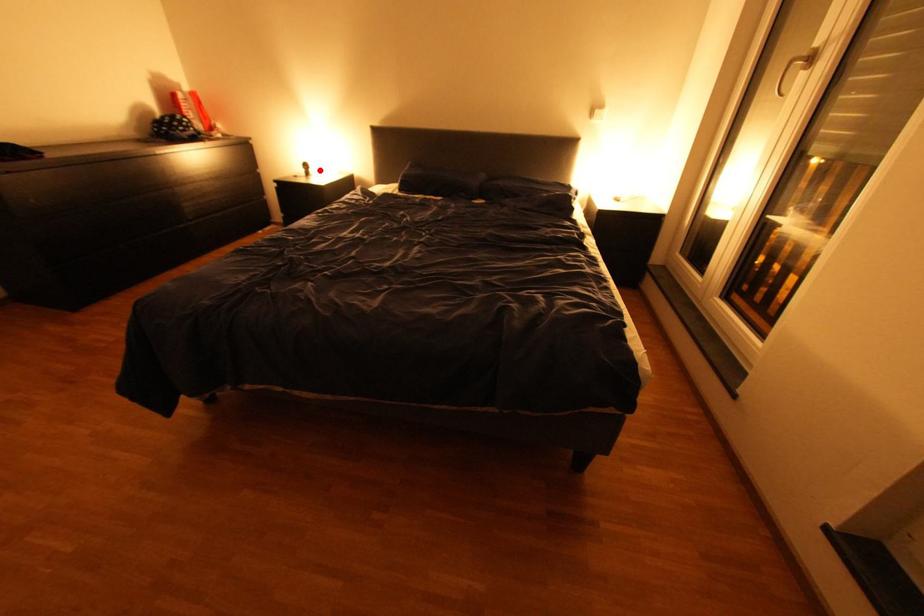
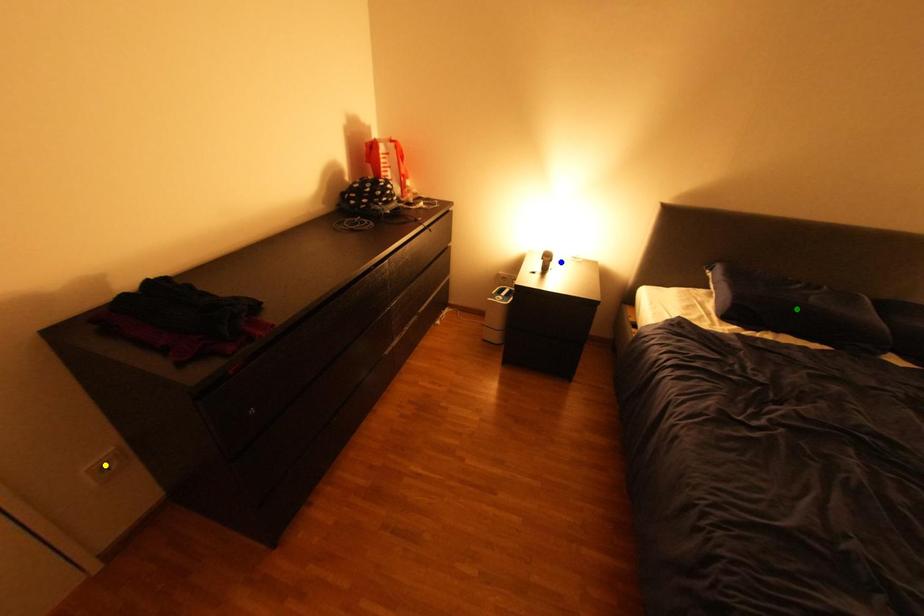
Question: I am providing you with two images of the same scene from different viewpoints. A red point is marked on the first image. You are given multiple points on the second image. Which spot in image 2 lines up with the point in image 1?

Choices:
 (A) green point
 (B) blue point
 (C) yellow point

Answer: (B)